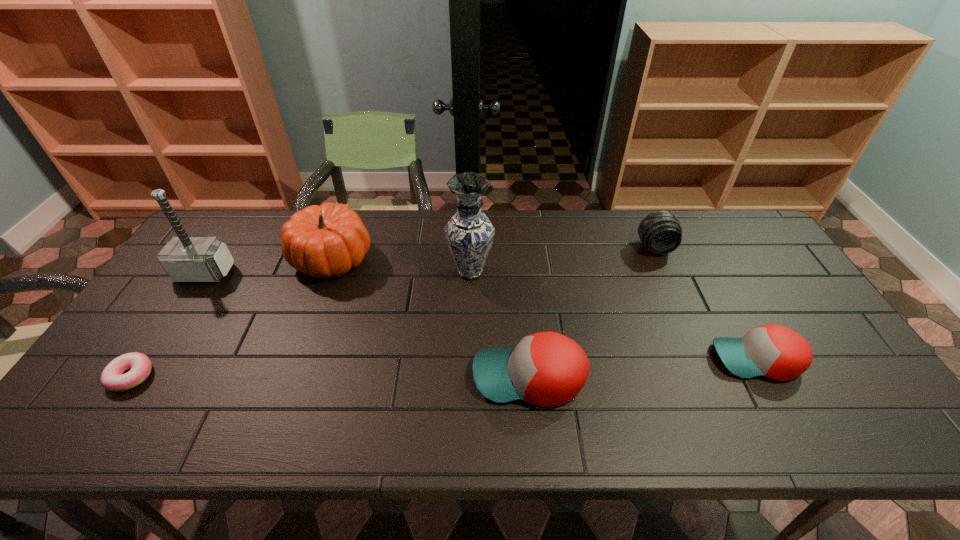
The width and height of the screenshot is (960, 540). What are the coordinates of `vacant region located 0.080m at the brim of the taller baseball cap` in the screenshot? It's located at (440, 377).

Image resolution: width=960 pixels, height=540 pixels. I want to click on vacant space positioned at the brim of the taller baseball cap, so click(x=332, y=377).

Find the location of a particular element. The width and height of the screenshot is (960, 540). free region located 0.330m at the brim of the right baseball cap is located at coordinates (582, 360).

This screenshot has height=540, width=960. I want to click on vacant region located at the brim of the right baseball cap, so click(x=649, y=360).

Locate an element on the screen. This screenshot has height=540, width=960. vacant area situated 0.400m at the brim of the right baseball cap is located at coordinates (554, 360).

This screenshot has height=540, width=960. In order to click on blank area located 0.160m at the front element of the telephoto lens in this screenshot , I will do `click(676, 295)`.

The height and width of the screenshot is (540, 960). Identify the location of vacant point located on the back of the pumpkin. (348, 215).

This screenshot has width=960, height=540. Identify the location of free spot located on the right of the vase. (583, 272).

This screenshot has height=540, width=960. I want to click on free space located 0.190m for striking with the head of the hammer, so click(163, 336).

Locate an element on the screen. This screenshot has width=960, height=540. free space located on the right of the doughnut is located at coordinates (203, 376).